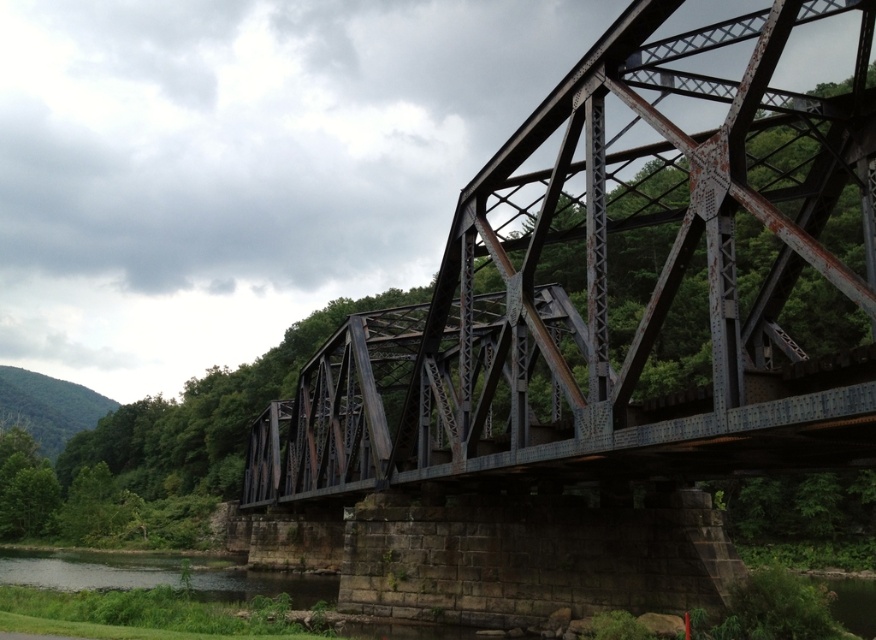
This screenshot has width=876, height=640. I want to click on rusty metal bridge at center, so click(627, 278).

What do you see at coordinates (627, 278) in the screenshot?
I see `rusty metal bridge at center` at bounding box center [627, 278].

Does point (857, 333) lie in front of point (138, 570)?

That is True.

The height and width of the screenshot is (640, 876). Identify the location of rusty metal bridge at center. (627, 278).